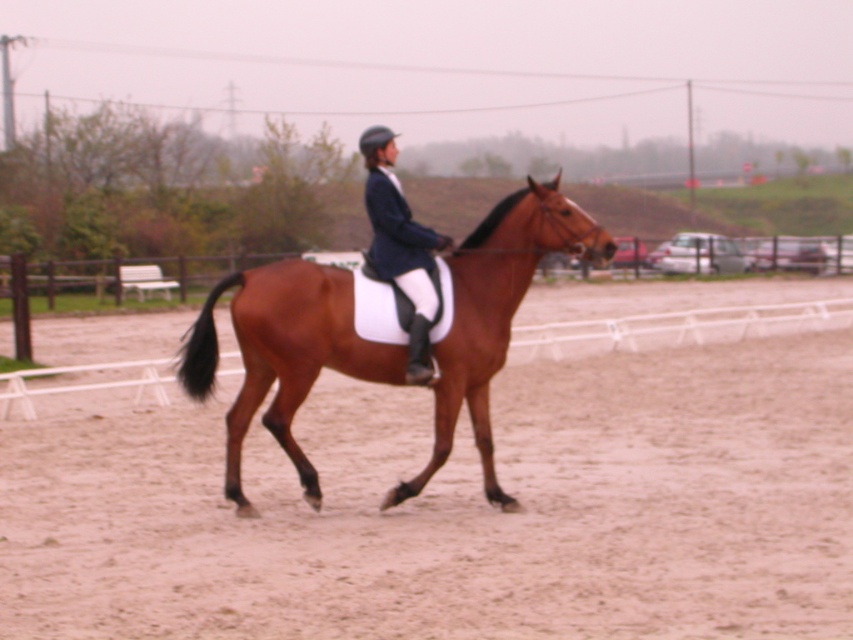
Question: Is brown glossy horse at center further to the viewer compared to matte black jacket at center?

Choices:
 (A) yes
 (B) no

Answer: (B)

Question: Can you confirm if brown glossy horse at center is thinner than matte black jacket at center?

Choices:
 (A) yes
 (B) no

Answer: (B)

Question: Is brown glossy horse at center below matte black jacket at center?

Choices:
 (A) no
 (B) yes

Answer: (B)